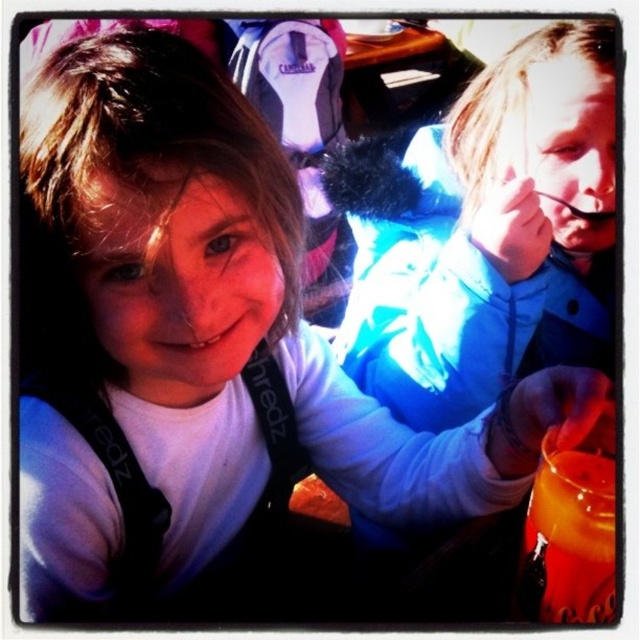
Based on the photo, between blue softshell jacket at upper right and orange liquid at lower right, which one has less height?

With less height is orange liquid at lower right.

Between point (426, 397) and point (595, 493), which one is positioned in front?

Point (595, 493) is more forward.

Identify the location of blue softshell jacket at upper right. The width and height of the screenshot is (640, 640). (484, 232).

Where is `blue softshell jacket at upper right`? This screenshot has width=640, height=640. blue softshell jacket at upper right is located at coordinates (484, 232).